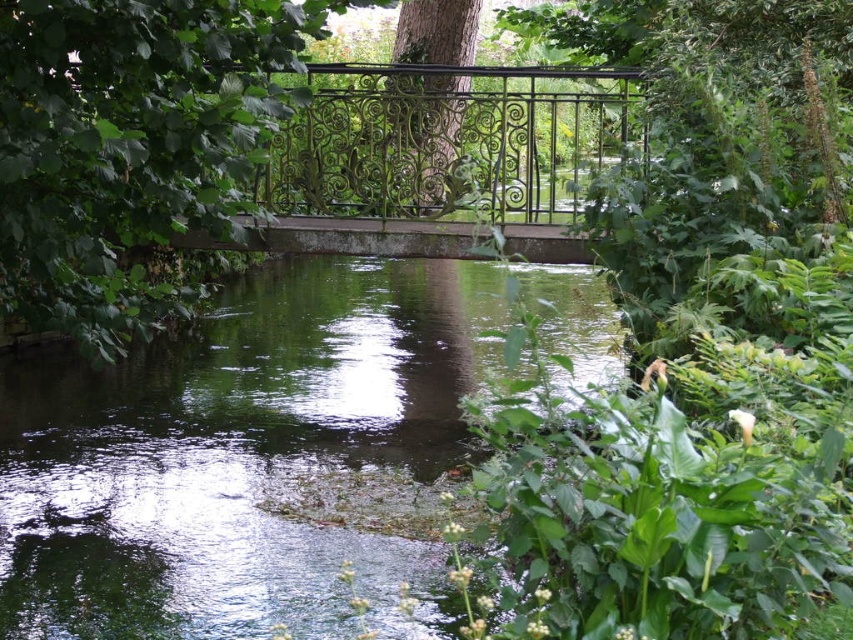
Is green leafy plant at center to the left of green wrought iron railing at center from the viewer's perspective?

Incorrect, green leafy plant at center is not on the left side of green wrought iron railing at center.

Who is positioned more to the left, green leafy plant at center or green wrought iron railing at center?

green wrought iron railing at center is more to the left.

Who is more distant from viewer, (650, 83) or (523, 97)?

The point (523, 97) is more distant.

Find the location of `green leafy plant at center`. green leafy plant at center is located at coordinates (700, 340).

Is green wrought iron railing at center smaller than green matte tree at center?

Actually, green wrought iron railing at center might be larger than green matte tree at center.

Is green wrought iron railing at center to the right of green matte tree at center from the viewer's perspective?

Correct, you'll find green wrought iron railing at center to the right of green matte tree at center.

Is point (468, 179) more distant than point (395, 36)?

No.

I want to click on green wrought iron railing at center, so click(x=445, y=138).

Which is behind, point (57, 253) or point (485, 134)?

The point (485, 134) is behind.

Who is taller, green leafy tree at center or green wrought iron railing at center?

green leafy tree at center is taller.

Describe the element at coordinates (129, 144) in the screenshot. This screenshot has width=853, height=640. I see `green leafy tree at center` at that location.

The image size is (853, 640). Identify the location of green leafy tree at center. (129, 144).